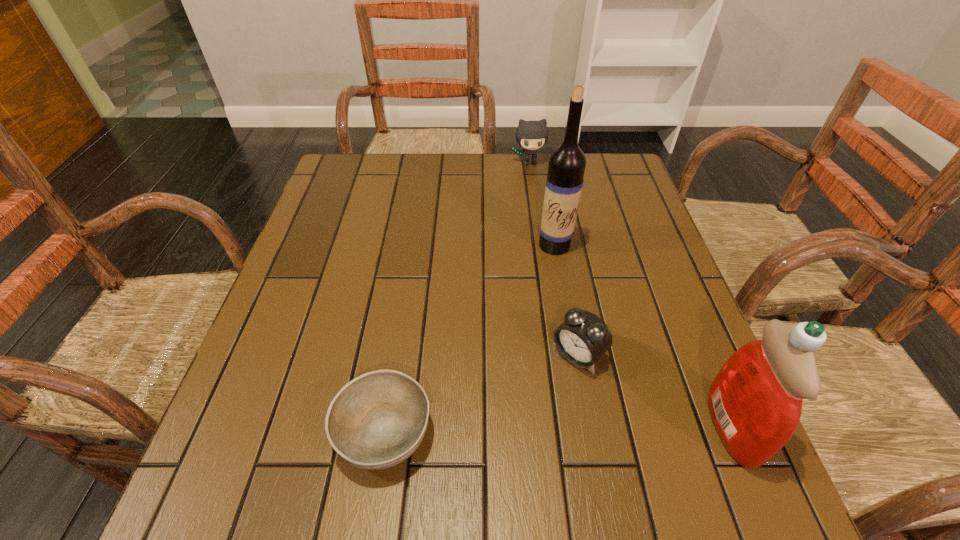
This screenshot has height=540, width=960. In order to click on free spot on the desktop that is between the shortest object and the second tallest object and is positioned on the label of the wine bottle in this screenshot , I will do `click(511, 429)`.

In order to click on vacant spot on the desktop that is between the leftmost object and the fourth shortest object and is positioned on the front-facing side of the third shortest object in this screenshot , I will do `click(590, 428)`.

Identify the location of vacant spot on the desktop that is between the leftmost object and the fourth shortest object and is positioned on the front side of the alarm clock. The width and height of the screenshot is (960, 540). pyautogui.click(x=508, y=429).